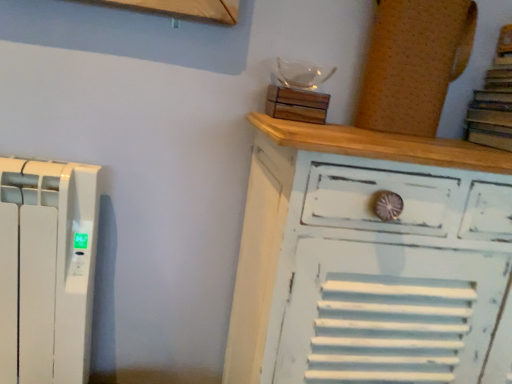
Question: Is white distressed wood chest of drawers at upper right taller than cork board at upper right, which is the first wood from right to left?

Choices:
 (A) no
 (B) yes

Answer: (B)

Question: From a real-world perspective, is white distressed wood chest of drawers at upper right positioned under cork board at upper right, which is the first wood from right to left, based on gravity?

Choices:
 (A) no
 (B) yes

Answer: (B)

Question: Considering the relative positions of white distressed wood chest of drawers at upper right and cork board at upper right, the second wood when ordered from left to right, in the image provided, is white distressed wood chest of drawers at upper right behind cork board at upper right, the second wood when ordered from left to right,?

Choices:
 (A) yes
 (B) no

Answer: (B)

Question: From a real-world perspective, is white distressed wood chest of drawers at upper right over cork board at upper right, which is the first wood from right to left?

Choices:
 (A) no
 (B) yes

Answer: (A)

Question: Is white distressed wood chest of drawers at upper right facing towards cork board at upper right, which is the first wood from right to left?

Choices:
 (A) no
 (B) yes

Answer: (A)

Question: Based on their positions, is white distressed wood chest of drawers at upper right located to the left or right of wooden block at upper center, which is counted as the 1th wood, starting from the left?

Choices:
 (A) right
 (B) left

Answer: (A)

Question: Is white distressed wood chest of drawers at upper right in front of or behind wooden block at upper center, which is counted as the 1th wood, starting from the left, in the image?

Choices:
 (A) behind
 (B) front

Answer: (B)

Question: Do you think white distressed wood chest of drawers at upper right is within wooden block at upper center, which is counted as the 1th wood, starting from the left, or outside of it?

Choices:
 (A) outside
 (B) inside

Answer: (A)

Question: Considering the positions of white distressed wood chest of drawers at upper right and wooden block at upper center, which is counted as the 1th wood, starting from the left, in the image, is white distressed wood chest of drawers at upper right bigger or smaller than wooden block at upper center, which is counted as the 1th wood, starting from the left,?

Choices:
 (A) small
 (B) big

Answer: (B)

Question: Considering their positions, is brown paper book at upper right located in front of or behind cork board at upper right, the second wood when ordered from left to right?

Choices:
 (A) behind
 (B) front

Answer: (B)

Question: Choose the correct answer: Is brown paper book at upper right inside cork board at upper right, the second wood when ordered from left to right, or outside it?

Choices:
 (A) inside
 (B) outside

Answer: (B)

Question: Considering the positions of point (495, 62) and point (464, 39), is point (495, 62) closer or farther from the camera than point (464, 39)?

Choices:
 (A) closer
 (B) farther

Answer: (B)

Question: Looking at the image, does brown paper book at upper right seem bigger or smaller compared to cork board at upper right, which is the first wood from right to left?

Choices:
 (A) big
 (B) small

Answer: (B)

Question: From the image's perspective, is wooden block at upper center, which is counted as the 1th wood, starting from the left, located above or below white distressed wood chest of drawers at upper right?

Choices:
 (A) below
 (B) above

Answer: (B)

Question: Is wooden block at upper center, positioned as the 2th wood in right-to-left order, spatially inside white distressed wood chest of drawers at upper right, or outside of it?

Choices:
 (A) outside
 (B) inside

Answer: (A)